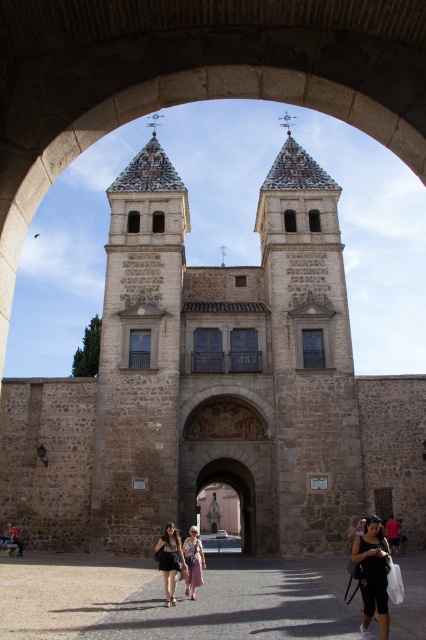
The width and height of the screenshot is (426, 640). Describe the element at coordinates (215, 387) in the screenshot. I see `gray stone church at center` at that location.

Is point (83, 467) farther from viewer compared to point (198, 538)?

Yes, it is.

Between point (141, 305) and point (196, 568), which one is positioned in front?

Point (196, 568) is more forward.

Where is `gray stone church at center`? The image size is (426, 640). gray stone church at center is located at coordinates (215, 387).

Is matte black bag at lower right to the right of light pink fabric skirt at center from the viewer's perspective?

Yes, matte black bag at lower right is to the right of light pink fabric skirt at center.

Does point (368, 516) come in front of point (198, 580)?

That is False.

Does point (382, 541) come farther from viewer compared to point (187, 547)?

No, (382, 541) is in front of (187, 547).

Locate an element on the screen. The image size is (426, 640). matte black bag at lower right is located at coordinates (373, 573).

Between gray stone church at center and matte black bag at lower right, which one is positioned higher?

gray stone church at center is above.

Is gray stone church at center behind matte black bag at lower right?

That is True.

What do you see at coordinates (215, 387) in the screenshot? The image size is (426, 640). I see `gray stone church at center` at bounding box center [215, 387].

In order to click on gray stone church at center in this screenshot , I will do `click(215, 387)`.